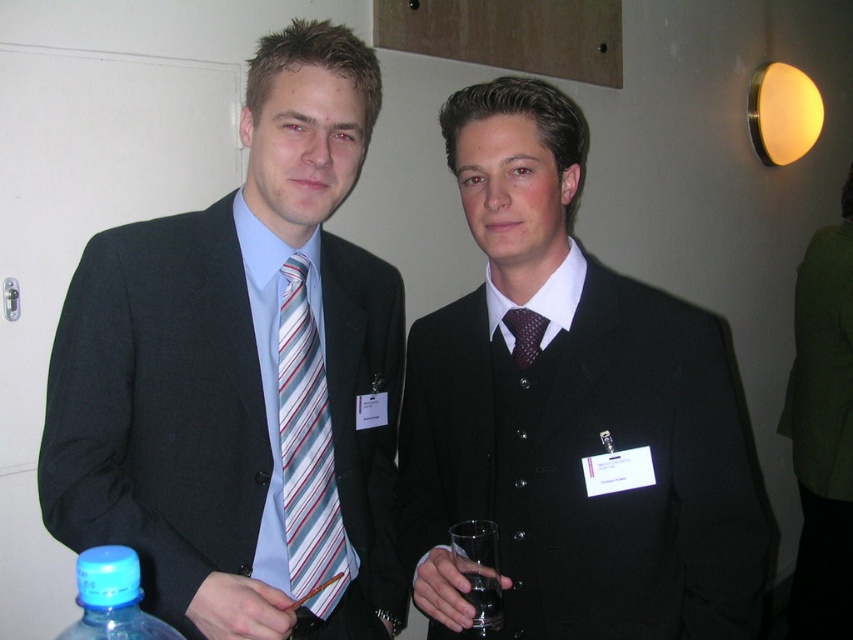
Is matte black suit at center above striped fabric tie at center?

Correct, matte black suit at center is located above striped fabric tie at center.

Is matte black suit at center bigger than striped fabric tie at center?

Yes.

Find the location of a particular element. Image resolution: width=853 pixels, height=640 pixels. matte black suit at center is located at coordinates tap(572, 413).

Does point (495, 227) come behind point (474, 602)?

Yes, point (495, 227) is behind point (474, 602).

Between matte black suit at center and transparent glass at center, which one is positioned higher?

Positioned higher is matte black suit at center.

Between point (546, 577) and point (490, 536), which one is positioned behind?

Point (546, 577)

Find the location of a particular element. matte black suit at center is located at coordinates [572, 413].

Can you confirm if matte black suit at left is taller than transparent glass at center?

Yes, matte black suit at left is taller than transparent glass at center.

Who is shorter, matte black suit at left or transparent glass at center?

With less height is transparent glass at center.

Does point (293, 552) come behind point (485, 592)?

That is True.

Identify the location of matte black suit at left. The image size is (853, 640). (242, 378).